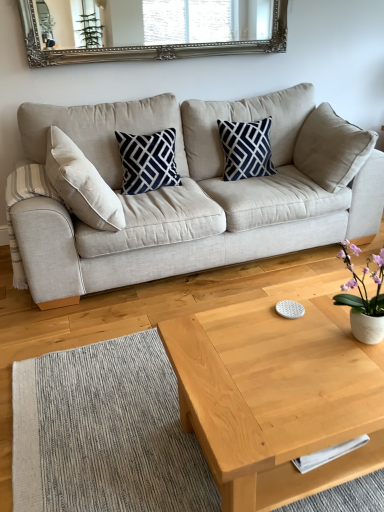
I want to click on free spot in front of white ceramic vase at right, so click(355, 381).